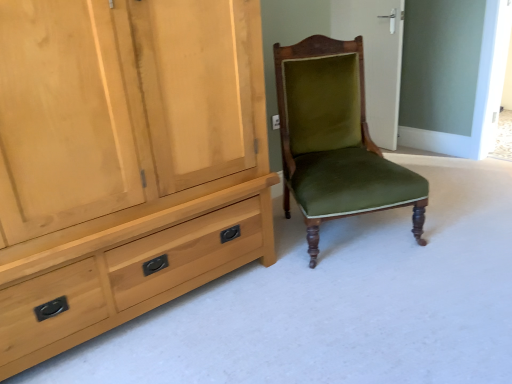
Find the location of `free location to the right of velvet green chair at center`. free location to the right of velvet green chair at center is located at coordinates (454, 220).